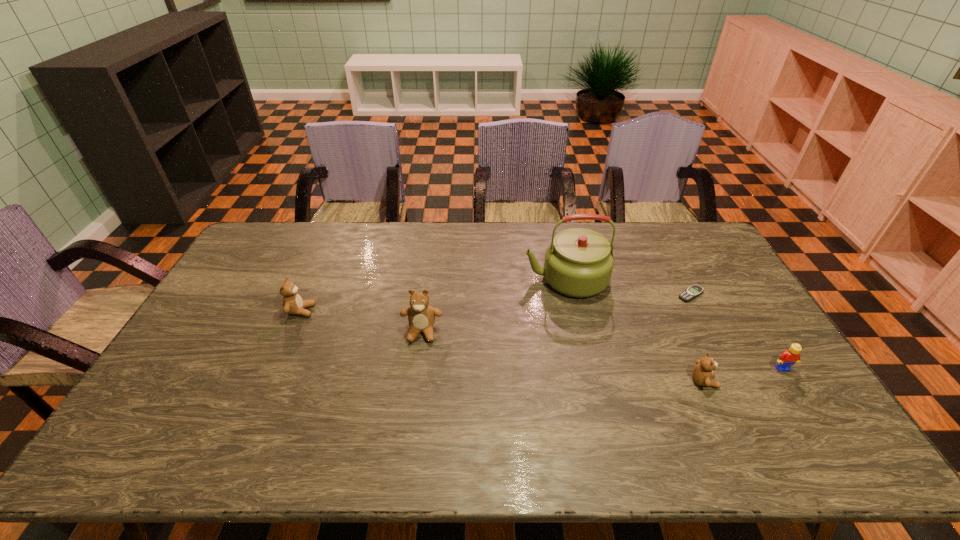
Identify the location of free point between the Lego and the leftmost object. This screenshot has height=540, width=960. (541, 340).

Where is `vacant space that is in between the Lego and the tallest object`? vacant space that is in between the Lego and the tallest object is located at coordinates (674, 323).

Where is `empty space that is in between the beeper and the tallest teddy bear`? The height and width of the screenshot is (540, 960). empty space that is in between the beeper and the tallest teddy bear is located at coordinates (556, 313).

Where is `free spot between the tallest object and the fourth shortest object`? free spot between the tallest object and the fourth shortest object is located at coordinates (433, 295).

Where is `blank region between the second tallest object and the Lego`? blank region between the second tallest object and the Lego is located at coordinates (602, 350).

You are a GUI agent. You are given a task and a screenshot of the screen. Output one action in this format:
    pyautogui.click(x=<x>, y=<y>)
    Task: Click on the empty space that is in between the rightmost object and the kettle
    The image size is (960, 540).
    Given the screenshot: What is the action you would take?
    pyautogui.click(x=674, y=323)

Locate an element on the screen. Image resolution: width=960 pixels, height=540 pixels. object identified as the second closest to the second teddy bear from right to left is located at coordinates (293, 304).

Find the location of a particular element. The image size is (960, 540). object that is the second closest one to the fifth shortest object is located at coordinates (293, 304).

Find the location of a particular element. the third closest teddy bear to the tallest object is located at coordinates (293, 304).

The height and width of the screenshot is (540, 960). Find the location of `teddy bear that can be found as the closest to the Lego`. teddy bear that can be found as the closest to the Lego is located at coordinates (702, 373).